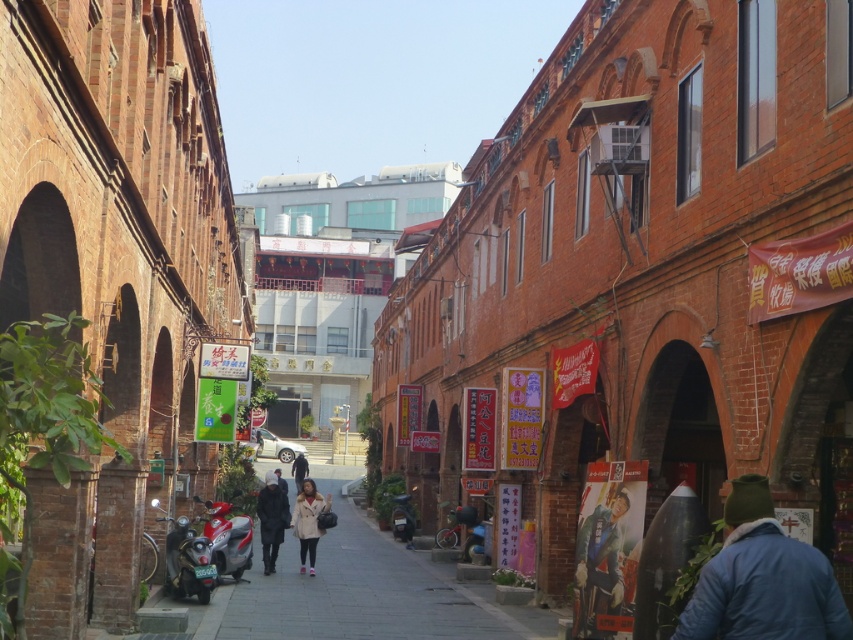
Question: Is smooth concrete pavement at center wider than dark gray fabric jacket at center?

Choices:
 (A) yes
 (B) no

Answer: (A)

Question: Which object is positioned closest to the dark gray knit hat at center?

Choices:
 (A) light brown leather jacket at center
 (B) shiny black scooter at lower left

Answer: (A)

Question: Does smooth concrete pavement at center appear over dark gray knit hat at center?

Choices:
 (A) yes
 (B) no

Answer: (A)

Question: Which object appears farthest from the camera in this image?

Choices:
 (A) light brown leather jacket at center
 (B) smooth concrete pavement at center
 (C) blue denim jacket at lower right

Answer: (A)

Question: Among these points, which one is farthest from the camera?

Choices:
 (A) (418, 627)
 (B) (747, 592)
 (C) (207, 561)

Answer: (C)

Question: Can you confirm if blue denim jacket at lower right is positioned below shiny black scooter at lower left?

Choices:
 (A) yes
 (B) no

Answer: (B)